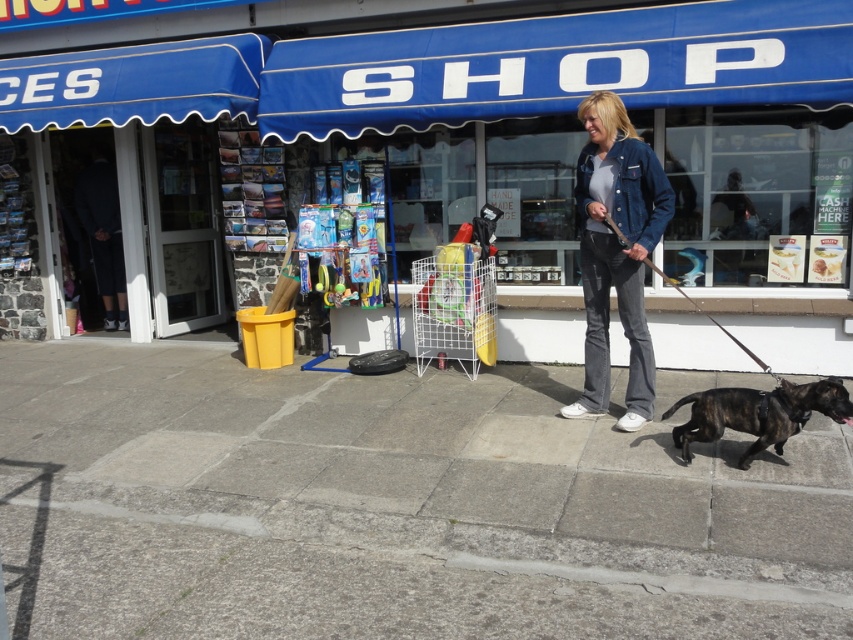
Question: Which point is closer to the camera?

Choices:
 (A) (614, 216)
 (B) (131, 492)

Answer: (B)

Question: Observing the image, what is the correct spatial positioning of blue fabric awning at upper center in reference to gray concrete pavement at lower center?

Choices:
 (A) below
 (B) above

Answer: (B)

Question: Which point is farther from the camera taking this photo?

Choices:
 (A) (801, 276)
 (B) (788, 385)

Answer: (A)

Question: Is blue fabric awning at upper center positioned at the back of gray concrete pavement at lower center?

Choices:
 (A) yes
 (B) no

Answer: (A)

Question: Which point is closer to the camera?

Choices:
 (A) brindle fur dog at lower right
 (B) blue fabric awning at upper center

Answer: (A)

Question: Is blue fabric awning at upper center smaller than brindle fur dog at lower right?

Choices:
 (A) no
 (B) yes

Answer: (A)